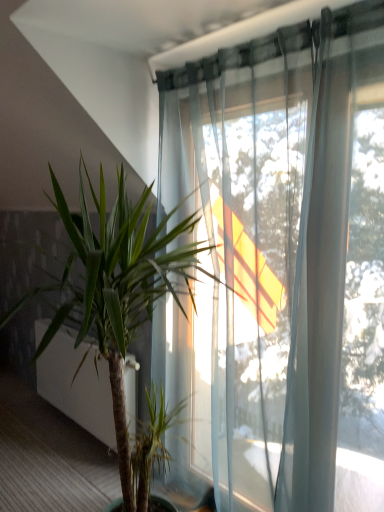
Find the location of `vacant space in front of green leafy plant at lower left`. vacant space in front of green leafy plant at lower left is located at coordinates (67, 468).